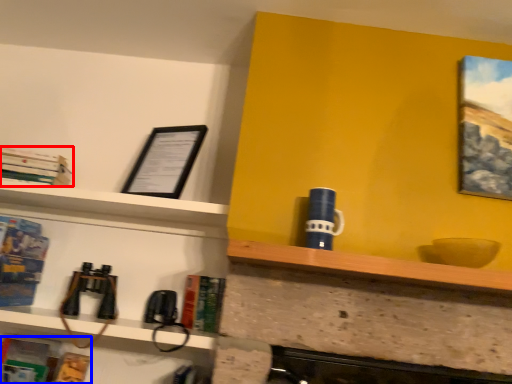
Question: Among these objects, which one is farthest to the camera, book (highlighted by a red box) or book (highlighted by a blue box)?

Choices:
 (A) book
 (B) book

Answer: (A)